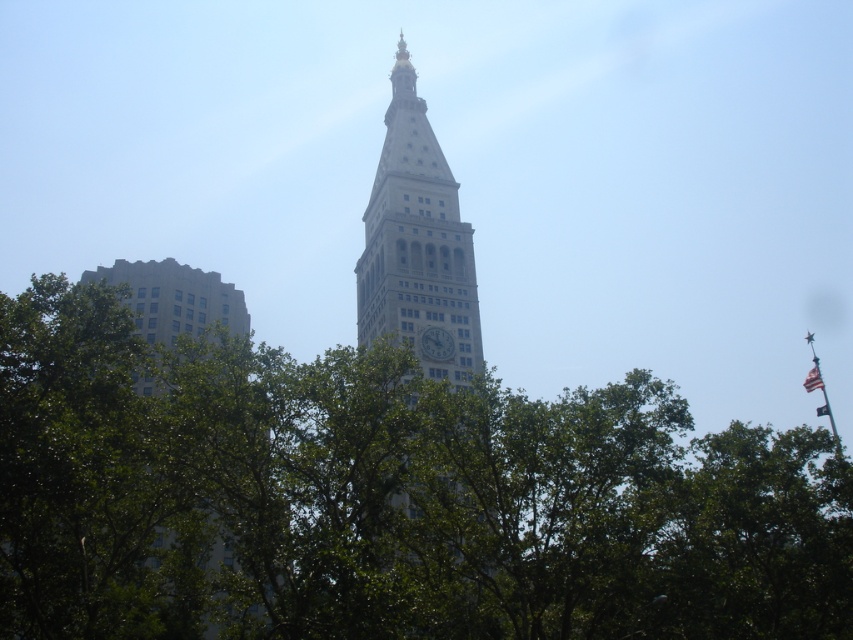
Can you confirm if white stone clock tower at center is bigger than american flag at right?

Correct, white stone clock tower at center is larger in size than american flag at right.

Measure the distance between white stone clock tower at center and camera.

white stone clock tower at center is 71.17 meters from camera.

The height and width of the screenshot is (640, 853). In order to click on white stone clock tower at center in this screenshot , I will do `click(416, 243)`.

Is american flag at right below american flag at upper right?

No, american flag at right is not below american flag at upper right.

Who is taller, american flag at right or american flag at upper right?

american flag at right

Who is more forward, [815,364] or [821,410]?

Point [815,364] is in front.

Where is `american flag at right`? american flag at right is located at coordinates (813, 378).

Can you confirm if green leafy tree at center is positioned below white stone clock tower at center?

Yes.

Can you confirm if green leafy tree at center is taller than white stone clock tower at center?

No.

Does point (184, 480) lie in front of point (433, 372)?

Yes, point (184, 480) is closer to viewer.

You are a GUI agent. You are given a task and a screenshot of the screen. Output one action in this format:
    pyautogui.click(x=<x>, y=<y>)
    Task: Click on the green leafy tree at center
    This screenshot has width=853, height=640.
    Given the screenshot: What is the action you would take?
    pyautogui.click(x=386, y=497)